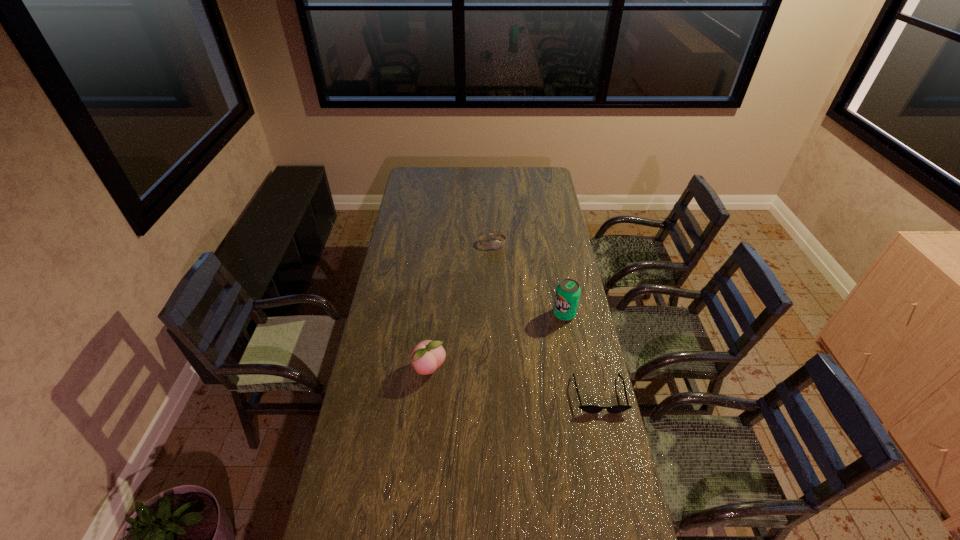
Where is `the leftmost object`? This screenshot has width=960, height=540. the leftmost object is located at coordinates [427, 356].

Locate an element on the screen. The width and height of the screenshot is (960, 540). peach is located at coordinates (427, 356).

I want to click on the shortest object, so click(586, 408).

At what (x,y) coordinates should I click in order to perform the action: click on the second farthest object. Please return your answer as a coordinate pair (x, y). Looking at the image, I should click on (567, 295).

Find the location of a particular element. Image resolution: width=960 pixels, height=540 pixels. pop soda is located at coordinates (567, 295).

At what (x,y) coordinates should I click in order to perform the action: click on the third tallest object. Please return your answer as a coordinate pair (x, y). The image size is (960, 540). Looking at the image, I should click on (496, 244).

Find the location of a particular element. This screenshot has height=540, width=960. watch is located at coordinates (496, 244).

Identify the location of free space located on the right of the third shortest object. The width and height of the screenshot is (960, 540). (463, 369).

Locate an element on the screen. Image resolution: width=960 pixels, height=540 pixels. vacant area situated 0.170m on the front-facing side of the shortest object is located at coordinates (614, 461).

Locate an element on the screen. This screenshot has width=960, height=540. free space located on the front-facing side of the third nearest object is located at coordinates (547, 329).